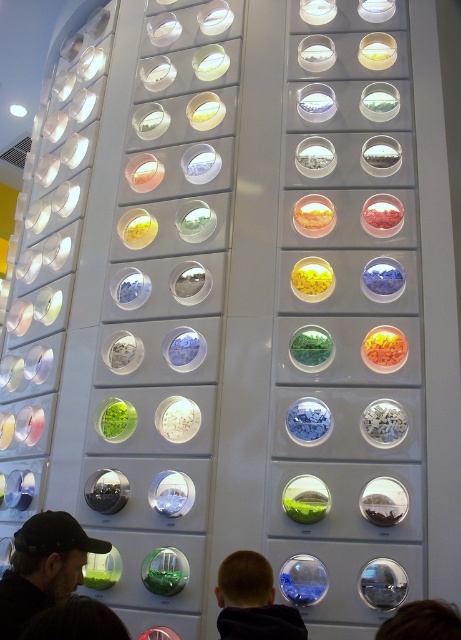
You are standing in front of the display wall and want to touch the dark brown hair at lower left and the brown hair at lower right. Which one can you reach first without moving your hand?

The dark brown hair at lower left is closer to the viewer than the brown hair at lower right, so you can reach it first without moving your hand.

You are an interior designer planning to add a new element to the display wall. You have two items to choose from, the dark brown leather cap at lower left and the brown hair at lower right. Since you want something that will stand out more in terms of height, which object should you select?

The dark brown leather cap at lower left is much taller than the brown hair at lower right, so you should select the dark brown leather cap at lower left to make the display wall more visually striking in terms of height.